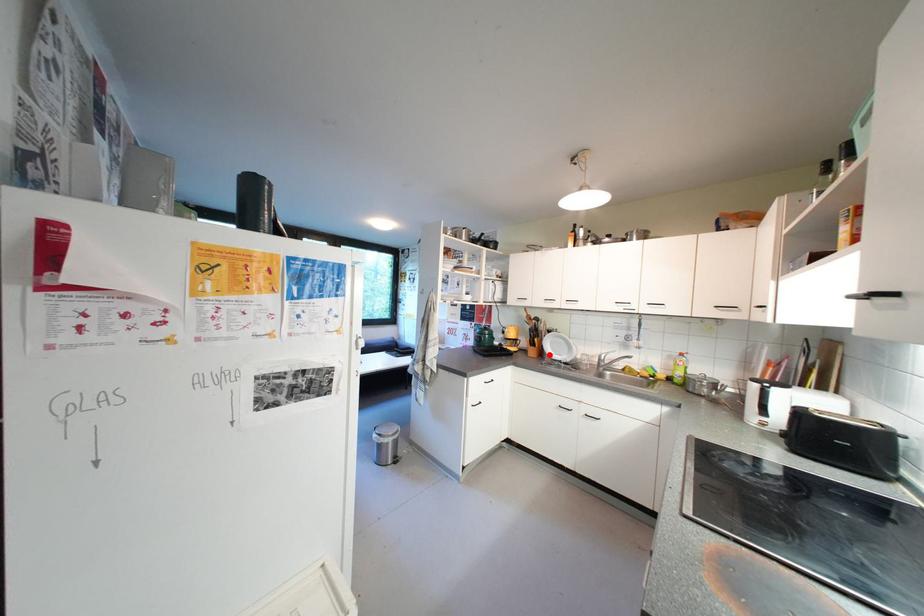
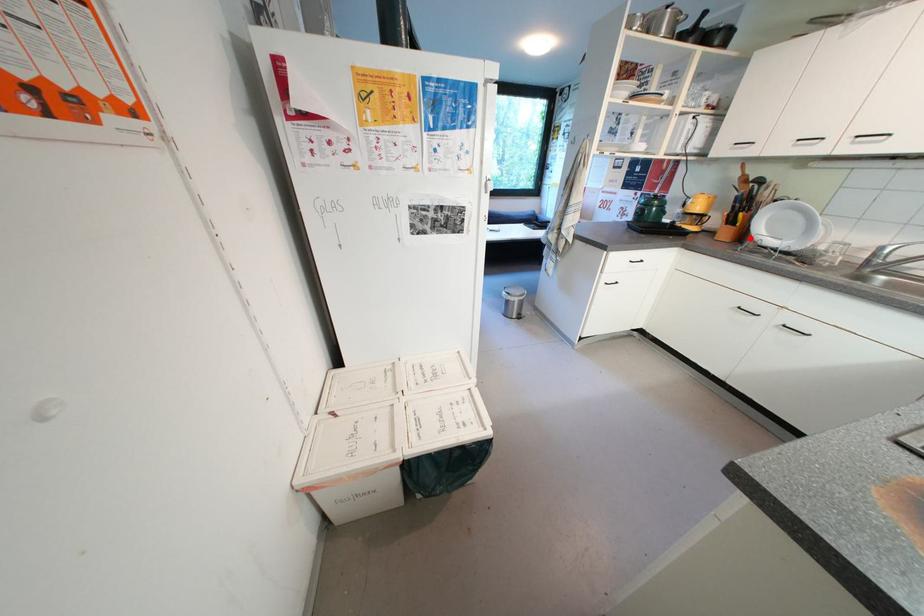
I am providing you with two images of the same scene from different viewpoints. A red point is marked on the first image and another point is marked on the second image. Do the highlighted points in image1 and image2 indicate the same real-world spot?

Yes